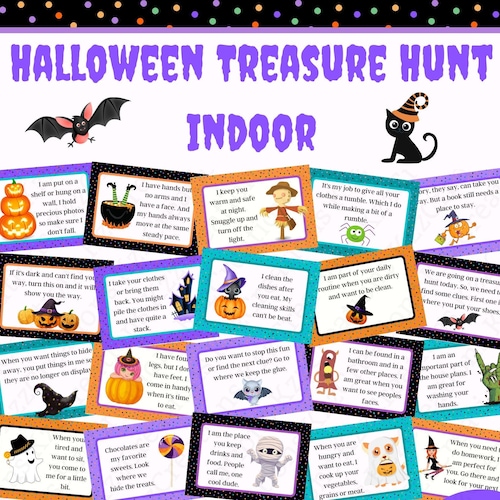
The image size is (500, 500). Find the location of `indoor`. indoor is located at coordinates (260, 117).